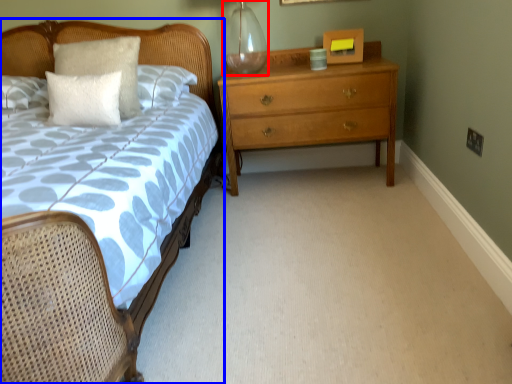
Question: Which object is further to the camera taking this photo, glass vase (highlighted by a red box) or bed (highlighted by a blue box)?

Choices:
 (A) glass vase
 (B) bed

Answer: (A)